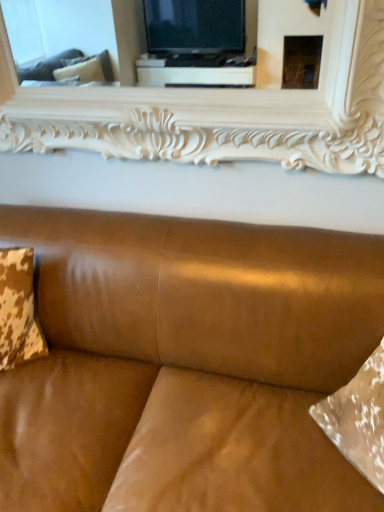
Question: From a real-world perspective, is cowhide fabric pillow at left positioned above or below white carved wood mirror at upper center?

Choices:
 (A) below
 (B) above

Answer: (A)

Question: Is point (26, 285) positioned closer to the camera than point (119, 69)?

Choices:
 (A) farther
 (B) closer

Answer: (B)

Question: Which object is the farthest from the cowhide fabric pillow at left?

Choices:
 (A) satin brown leather couch at center
 (B) white carved wood mirror at upper center

Answer: (B)

Question: Which of these objects is positioned closest to the satin brown leather couch at center?

Choices:
 (A) cowhide fabric pillow at left
 (B) white carved wood mirror at upper center

Answer: (A)